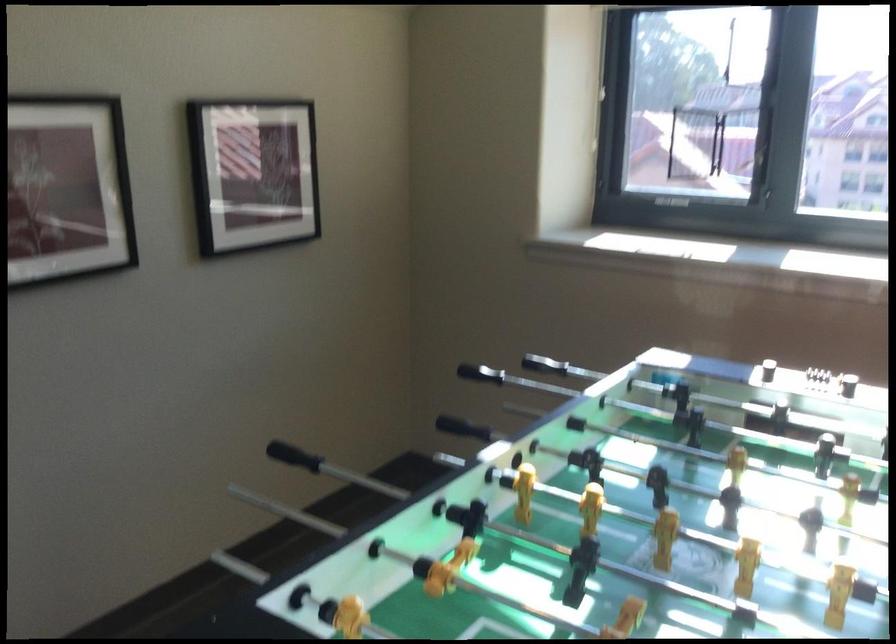
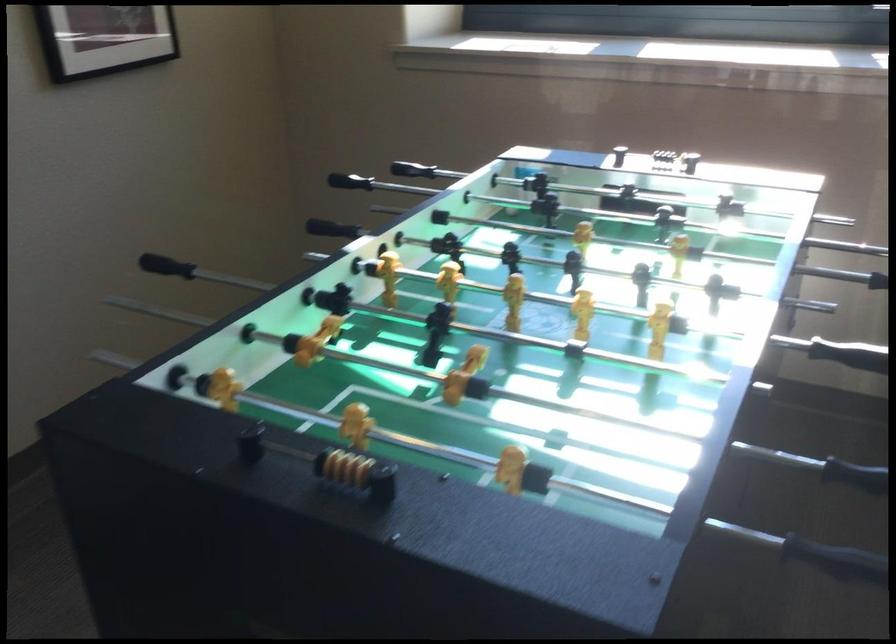
What movement of the cameraman would produce the second image?

The movement direction of the cameraman is right, backward.